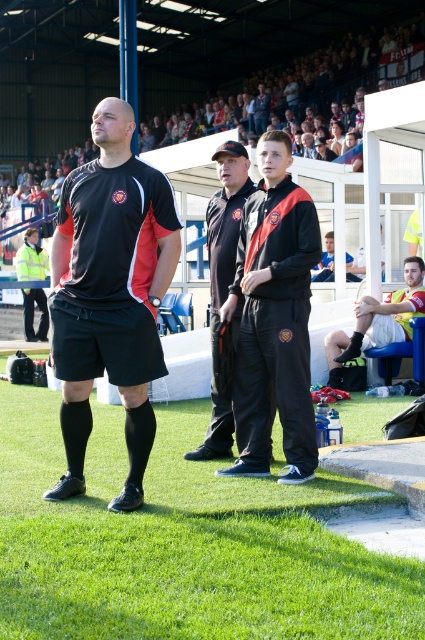
Question: Estimate the real-world distances between objects in this image. Which object is farther from the blue fabric shirt at center?

Choices:
 (A) green grass at lower left
 (B) matte black jacket at center
 (C) black matte shorts at center

Answer: (A)

Question: Does black matte tracksuit at center have a larger size compared to yellow/textured fabric shirt at lower right?

Choices:
 (A) no
 (B) yes

Answer: (A)

Question: Which point is closer to the camera?

Choices:
 (A) black matte tracksuit at center
 (B) yellow/textured fabric shirt at lower right
 (C) green grass at lower left

Answer: (C)

Question: Does green grass at lower left come in front of black matte tracksuit at center?

Choices:
 (A) no
 (B) yes

Answer: (B)

Question: Estimate the real-world distances between objects in this image. Which object is closer to the blue fabric shirt at center?

Choices:
 (A) black matte tracksuit at center
 (B) matte black jacket at center
 (C) yellow/textured fabric shirt at lower right
 (D) black matte shorts at center

Answer: (C)

Question: Can you confirm if black matte tracksuit at center is positioned below blue fabric shirt at center?

Choices:
 (A) yes
 (B) no

Answer: (A)